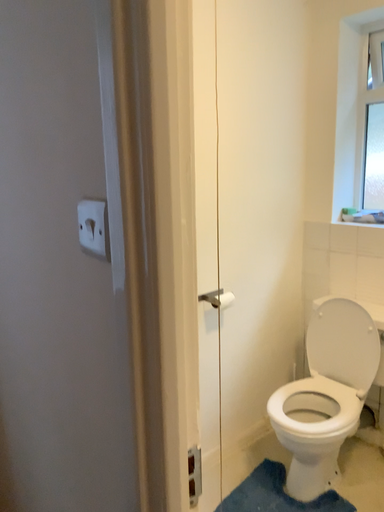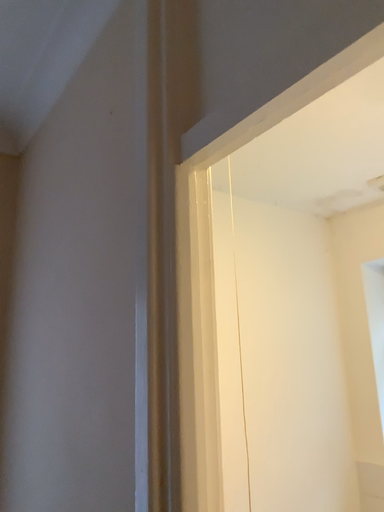
Question: Which way did the camera rotate in the video?

Choices:
 (A) rotated downward
 (B) rotated upward

Answer: (B)